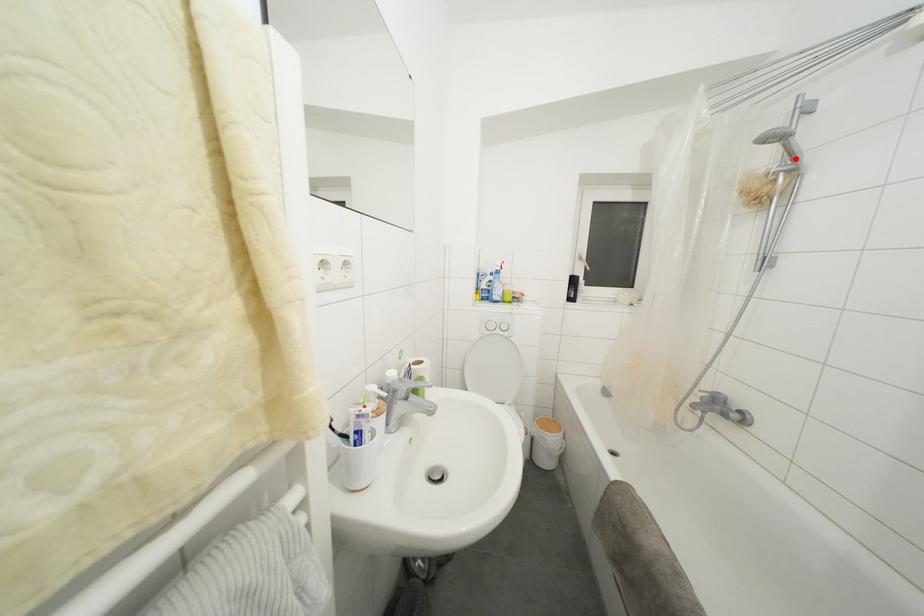
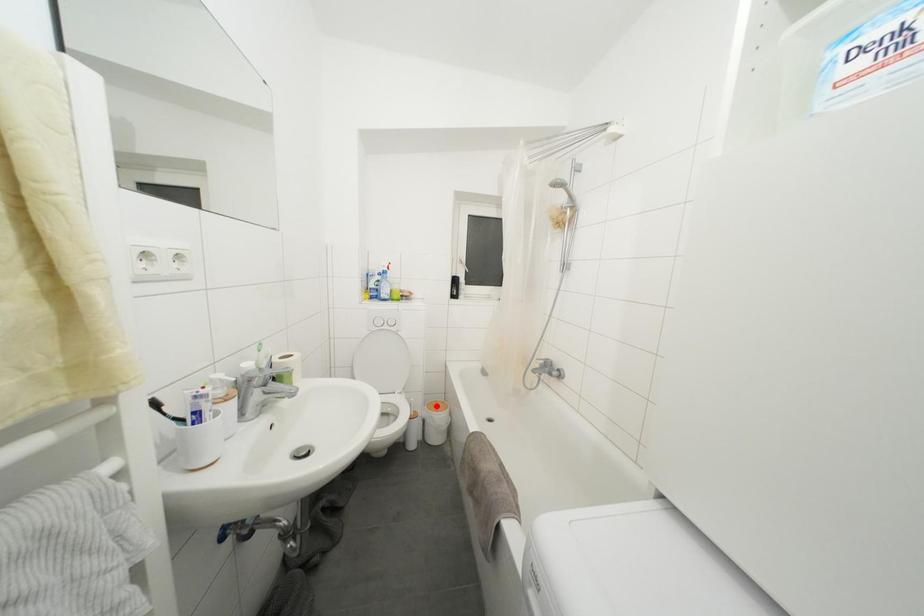
I am providing you with two images of the same scene from different viewpoints. A red point is marked on the first image and another point is marked on the second image. Does the point marked in image1 correspond to the same location as the one in image2?

No